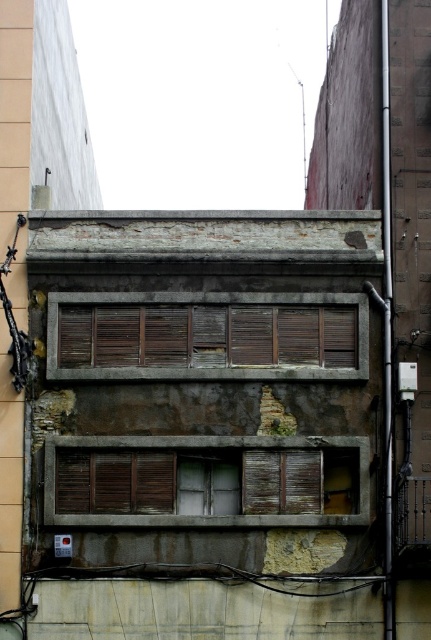
You are a window installer assessing the building facade. You need to replace the brown wooden shutters at center. Where exactly should you position the new shutters to match the existing structure?

The new brown wooden shutters at center should be positioned at the coordinates point (206, 337) to align with the existing structure.